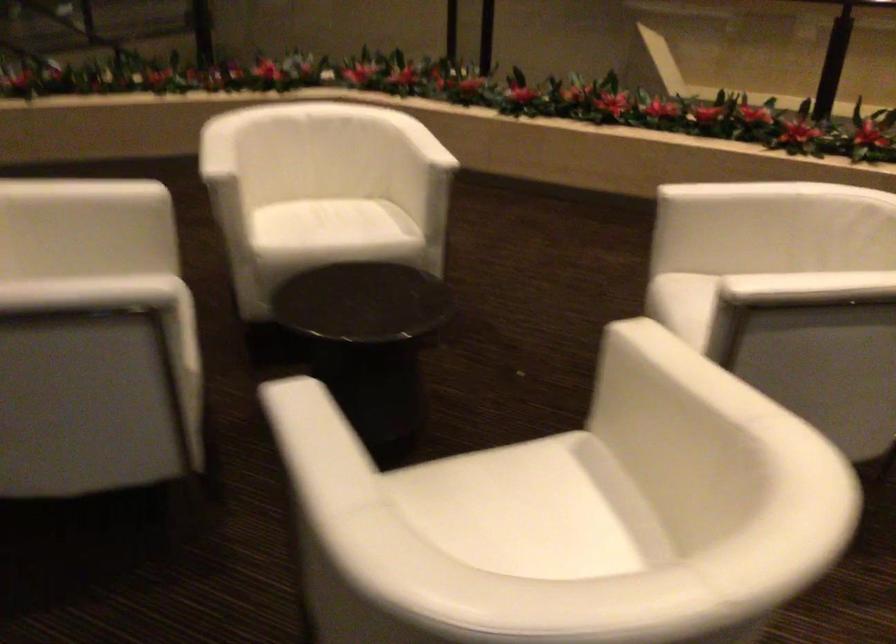
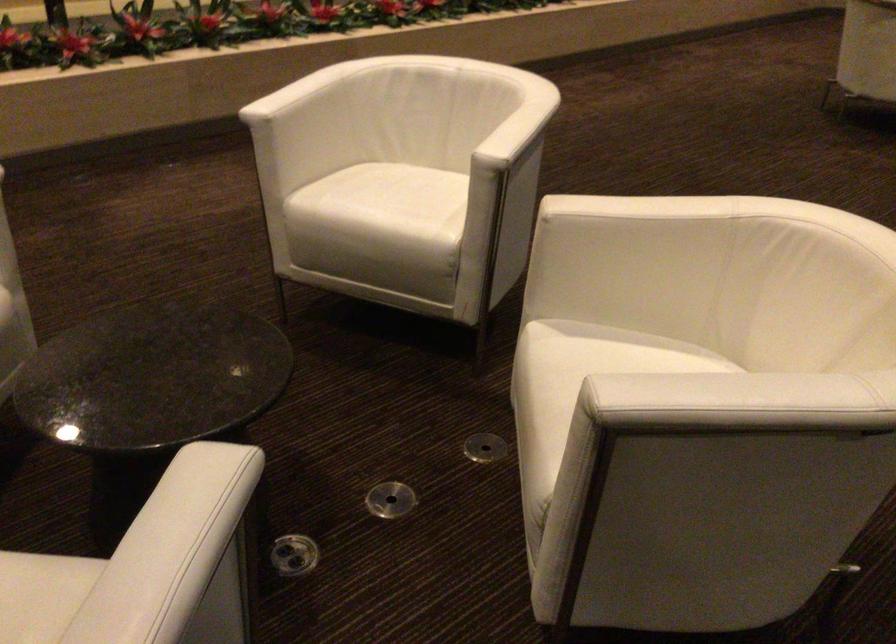
In the second image, find the point that corresponds to [522,475] in the first image.

(581, 366)